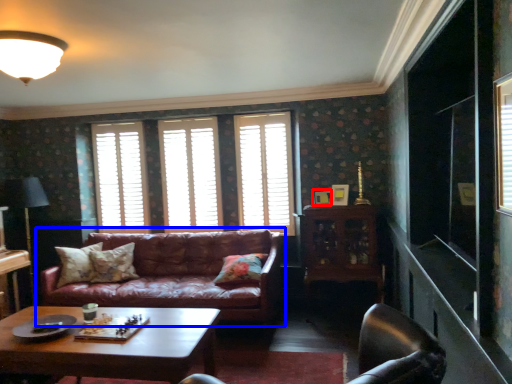
Question: Which of the following is the closest to the observer, picture frame (highlighted by a red box) or studio couch (highlighted by a blue box)?

Choices:
 (A) picture frame
 (B) studio couch

Answer: (B)